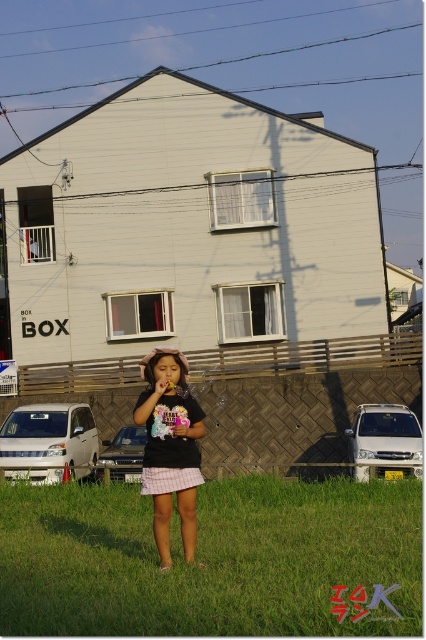
You are standing in the suburban scene looking at the young girl blowing bubbles. There is a specific point marked at coordinates point (409, 512). If you want to reach that point without moving closer to the girl, which direction should you move in relation to the girl?

The point (409, 512) is 8.52 meters away from the viewer. Since you need to reach it without moving closer to the girl, you should move away from the girl while maintaining your distance to reach the point.

You are a photographer trying to capture the green grass at center and the matte pink flower at center in the same frame. Based on their positions and sizes, which object would appear larger in the photo?

The green grass at center would appear larger in the photo because it is wider than the matte pink flower at center.